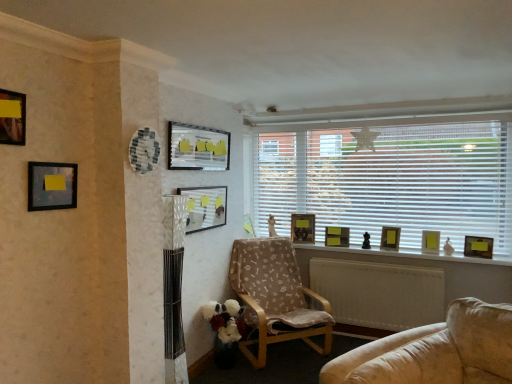
Question: From the image's perspective, relative to matte black picture frame at upper left, which appears as the eighth picture frame when viewed from the right, is wooden window sill at center above or below?

Choices:
 (A) below
 (B) above

Answer: (A)

Question: From a real-world perspective, is wooden window sill at center above or below matte black picture frame at upper left, which appears as the eighth picture frame when viewed from the right?

Choices:
 (A) below
 (B) above

Answer: (A)

Question: Which of these objects is positioned farthest from the wooden photo frame at center, the 5th picture frame in the right-to-left sequence?

Choices:
 (A) matte black picture frame at upper left, the second picture frame positioned from the left
 (B) matte black picture frame at center, the fourth picture frame when ordered from right to left
 (C) white blinds at upper right
 (D) matte black picture frame at upper center, arranged as the 7th picture frame when viewed from the back
 (E) yellow matte picture frame at right, positioned as the 8th picture frame in left-to-right order

Answer: (A)

Question: Which object is positioned farthest from the wooden window sill at center?

Choices:
 (A) wooden armchair at center
 (B) matte black picture frame at upper left, acting as the first picture frame starting from the front
 (C) yellow matte picture frame at right, the 6th picture frame from the front
 (D) matte black picture frame at center, which appears as the sixth picture frame when viewed from the left
 (E) wooden photo frame at center, the fifth picture frame viewed from the left

Answer: (B)